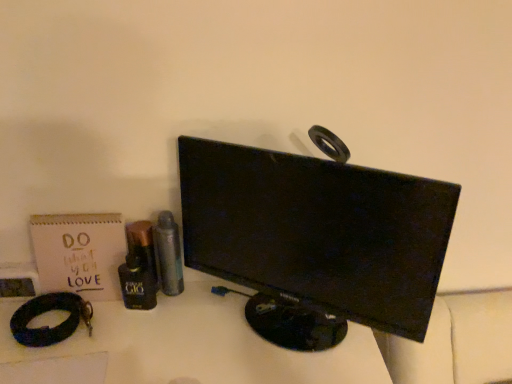
Question: Which is correct: black leather bracelet at lower left is inside metallic silver spray can at center-left, marked as the 3th toiletry in a left-to-right arrangement, or outside of it?

Choices:
 (A) inside
 (B) outside

Answer: (B)

Question: Is black leather bracelet at lower left wider or thinner than metallic silver spray can at center-left, marked as the 3th toiletry in a left-to-right arrangement?

Choices:
 (A) thin
 (B) wide

Answer: (B)

Question: Estimate the real-world distances between objects in this image. Which object is farther from the metallic silver spray can at center-left, placed as the first toiletry when sorted from right to left?

Choices:
 (A) matte paper notebook at left
 (B) black glossy monitor at center
 (C) shiny black bottle at center left, the 2th toiletry when ordered from right to left
 (D) black leather bracelet at lower left
 (E) shiny brown bottle at center-left, the 1th toiletry positioned from the left

Answer: (B)

Question: Which of these objects is positioned farthest from the black leather bracelet at lower left?

Choices:
 (A) matte paper notebook at left
 (B) metallic silver spray can at center-left, marked as the 3th toiletry in a left-to-right arrangement
 (C) shiny black bottle at center left, the 2th toiletry when ordered from right to left
 (D) shiny brown bottle at center-left, acting as the 3th toiletry starting from the right
 (E) black glossy monitor at center

Answer: (E)